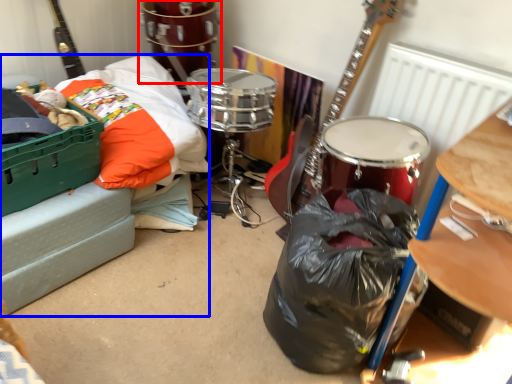
Question: Which object appears farthest to the camera in this image, drum (highlighted by a red box) or couch (highlighted by a blue box)?

Choices:
 (A) drum
 (B) couch

Answer: (A)